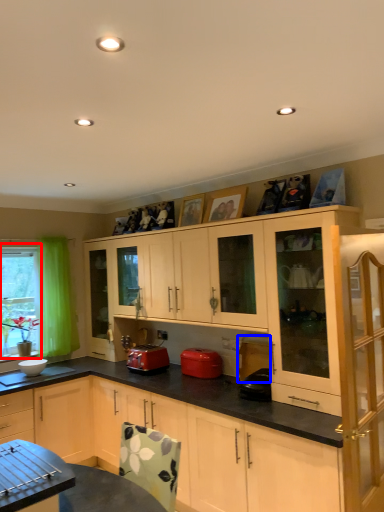
Question: Which object is further to the camera taking this photo, bay window (highlighted by a red box) or appliance (highlighted by a blue box)?

Choices:
 (A) bay window
 (B) appliance

Answer: (A)